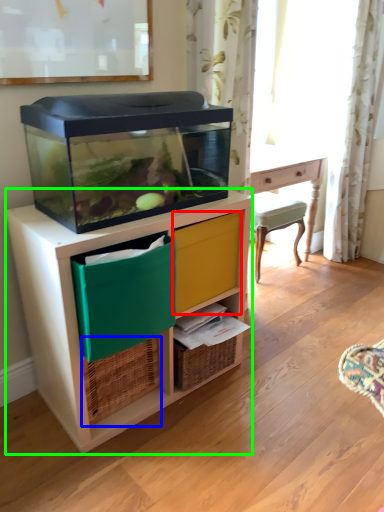
Question: Which object is the farthest from drawer (highlighted by a red box)? Choose among these: basket (highlighted by a blue box) or chest of drawers (highlighted by a green box).

Choices:
 (A) basket
 (B) chest of drawers

Answer: (A)